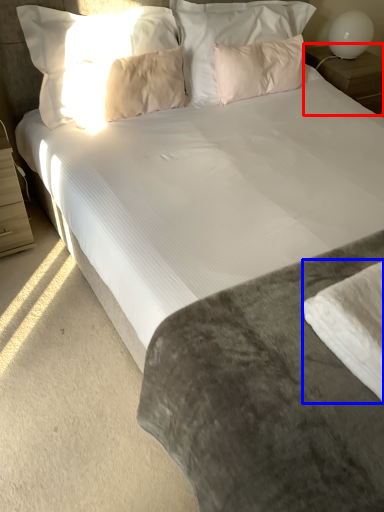
Question: Among these objects, which one is nearest to the camera, nightstand (highlighted by a red box) or sheet (highlighted by a blue box)?

Choices:
 (A) nightstand
 (B) sheet

Answer: (B)